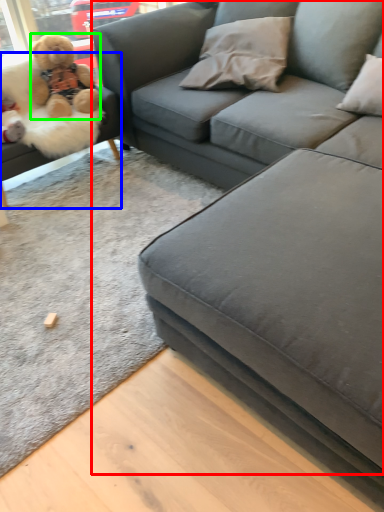
Question: Which object is the closest to the studio couch (highlighted by a red box)? Choose among these: studio couch (highlighted by a blue box) or teddy bear (highlighted by a green box).

Choices:
 (A) studio couch
 (B) teddy bear

Answer: (B)